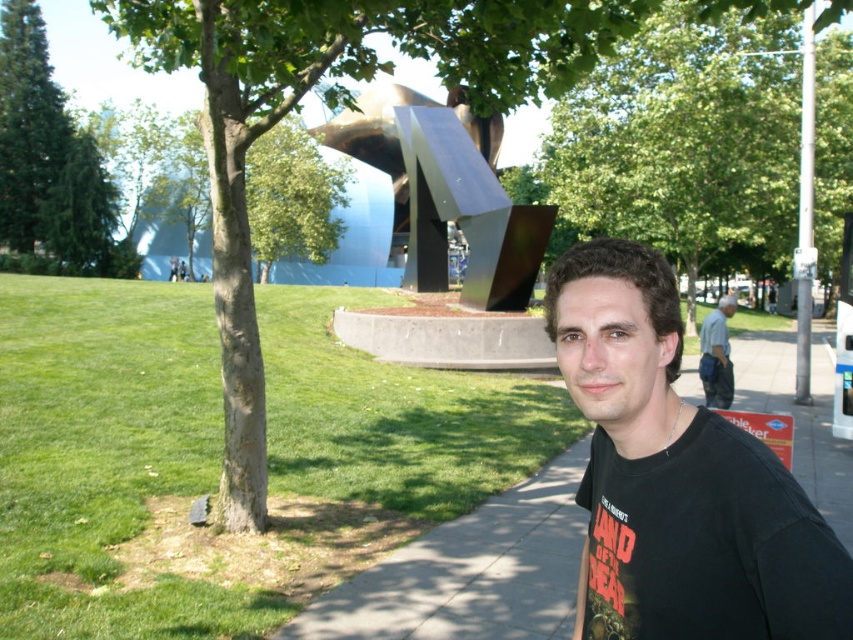
Question: Which point is closer to the camera?

Choices:
 (A) (712, 330)
 (B) (595, 454)

Answer: (B)

Question: Which point is closer to the camera?

Choices:
 (A) black matte shirt at center
 (B) metallic silver sculpture at center
 (C) green leafy tree at upper center
 (D) gray fabric bag at lower right

Answer: (A)

Question: Is gray concrete sidewalk at lower center smaller than gray fabric bag at lower right?

Choices:
 (A) yes
 (B) no

Answer: (A)

Question: Which point is closer to the camera taking this photo?

Choices:
 (A) click(x=718, y=340)
 (B) click(x=590, y=104)
 (C) click(x=814, y=440)
 (D) click(x=625, y=621)

Answer: (D)

Question: Can you confirm if black matte shirt at center is positioned above gray concrete sidewalk at lower center?

Choices:
 (A) yes
 (B) no

Answer: (A)

Question: In this image, where is black matte shirt at center located relative to gray concrete sidewalk at lower center?

Choices:
 (A) left
 (B) right

Answer: (A)